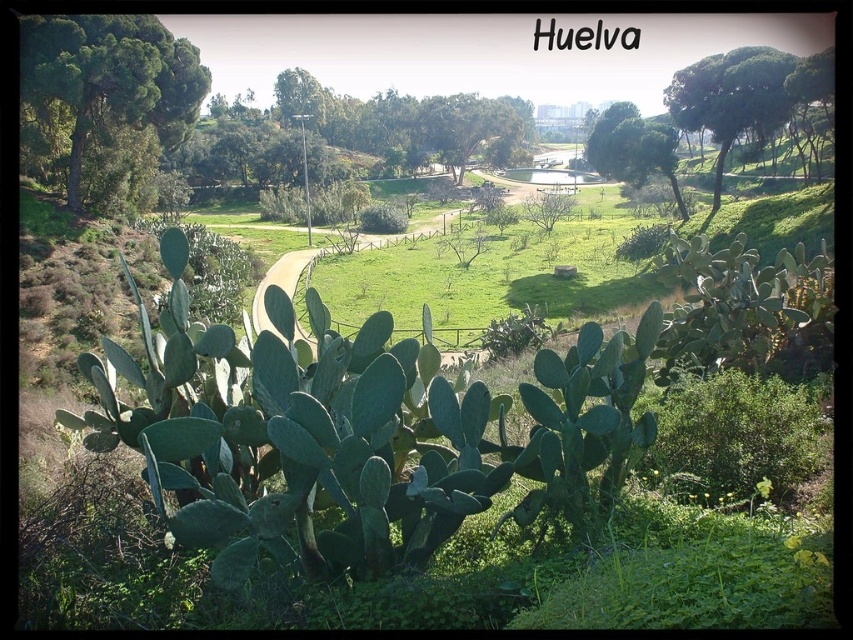
Between point (149, 16) and point (773, 68), which one is positioned behind?

The point (773, 68) is behind.

Does green leafy tree at upper left appear over green leafy tree at upper right?

No, green leafy tree at upper left is not above green leafy tree at upper right.

Identify the location of green leafy tree at upper left. The width and height of the screenshot is (853, 640). (109, 81).

The height and width of the screenshot is (640, 853). I want to click on green leafy tree at upper left, so click(x=109, y=81).

Who is positioned more to the right, green leafy tree at upper left or green leafy tree at upper center?

green leafy tree at upper center

Who is more forward, (51, 40) or (637, 172)?

Point (51, 40)

Is point (196, 104) in front of point (614, 164)?

Yes.

You are a GUI agent. You are given a task and a screenshot of the screen. Output one action in this format:
    pyautogui.click(x=<x>, y=<y>)
    Task: Click on the green leafy tree at upper left
    The image size is (853, 640).
    Given the screenshot: What is the action you would take?
    pyautogui.click(x=109, y=81)

Does green leafy tree at center appear over green leafy tree at upper right?

Indeed, green leafy tree at center is positioned over green leafy tree at upper right.

Locate an element on the screen. The height and width of the screenshot is (640, 853). green leafy tree at center is located at coordinates (409, 124).

What are the coordinates of `green leafy tree at center` in the screenshot? It's located at (409, 124).